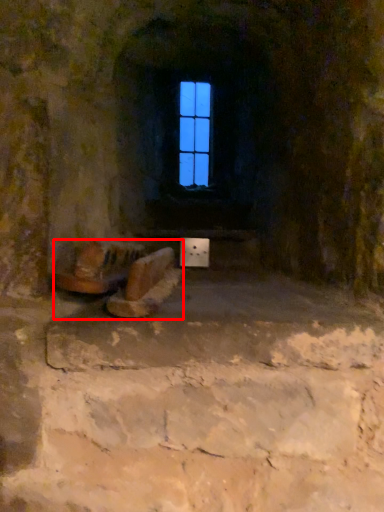
Question: Considering the relative positions of furniture (annotated by the red box) and window in the image provided, where is furniture (annotated by the red box) located with respect to the staircase?

Choices:
 (A) left
 (B) right

Answer: (A)